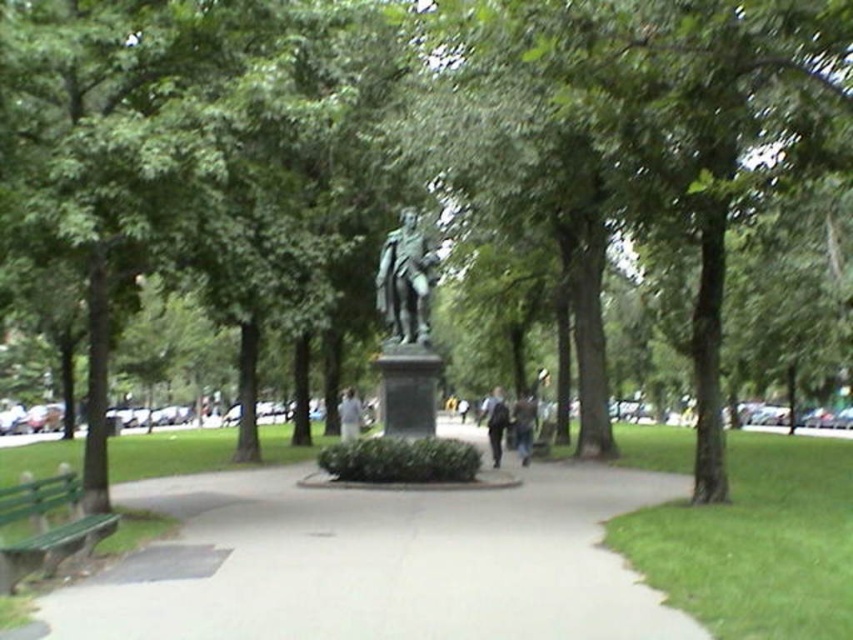
You are a park visitor who wants to take a photo of the bronze statue at center and the dark gray jacket at center. Since you want both objects to be clearly visible in the frame, which one should you zoom in on more to ensure both are visible?

The bronze statue at center is thinner than the dark gray jacket at center, so you should zoom in more on the dark gray jacket at center to ensure both objects are clearly visible in the frame.